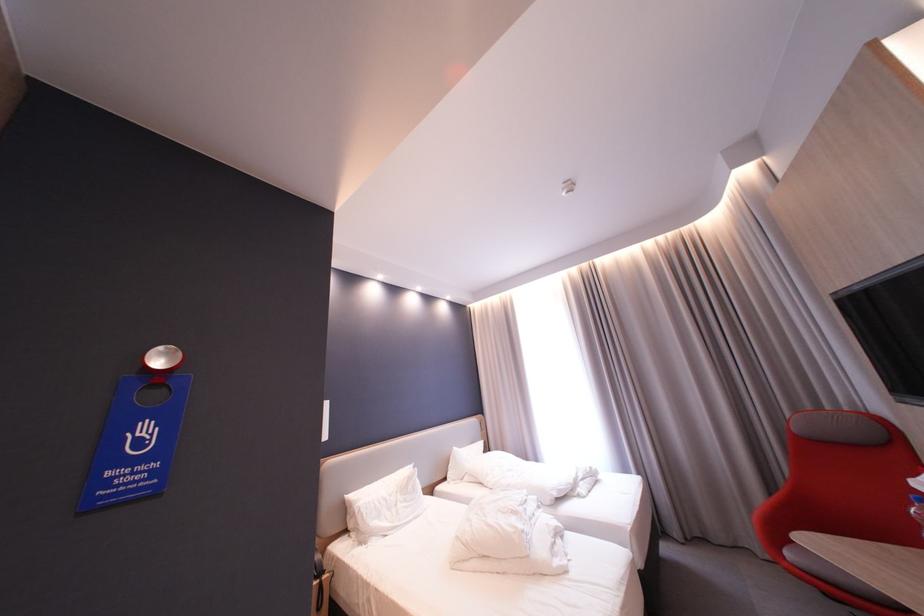
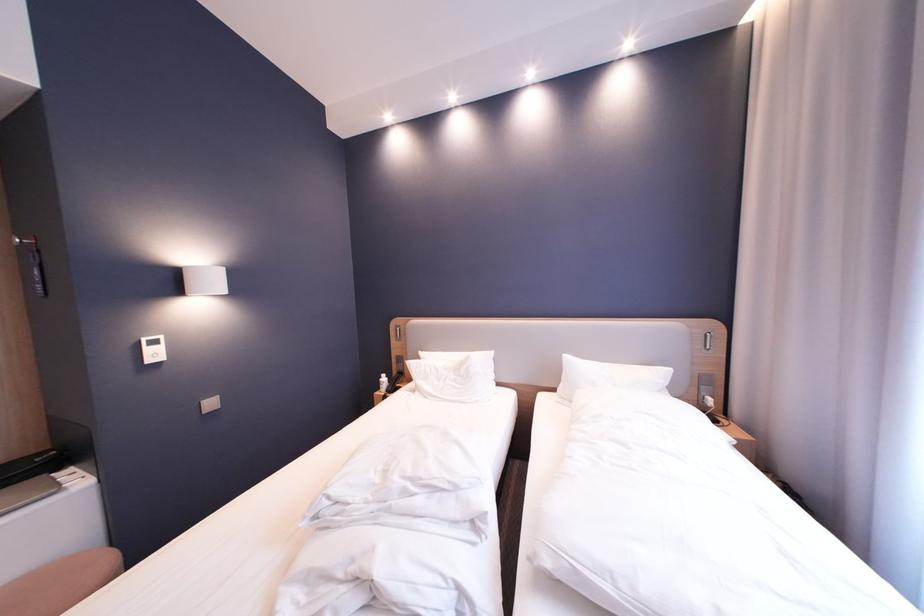
Find the pixel in the second image that matches pixel 456 480 in the first image.

(565, 391)